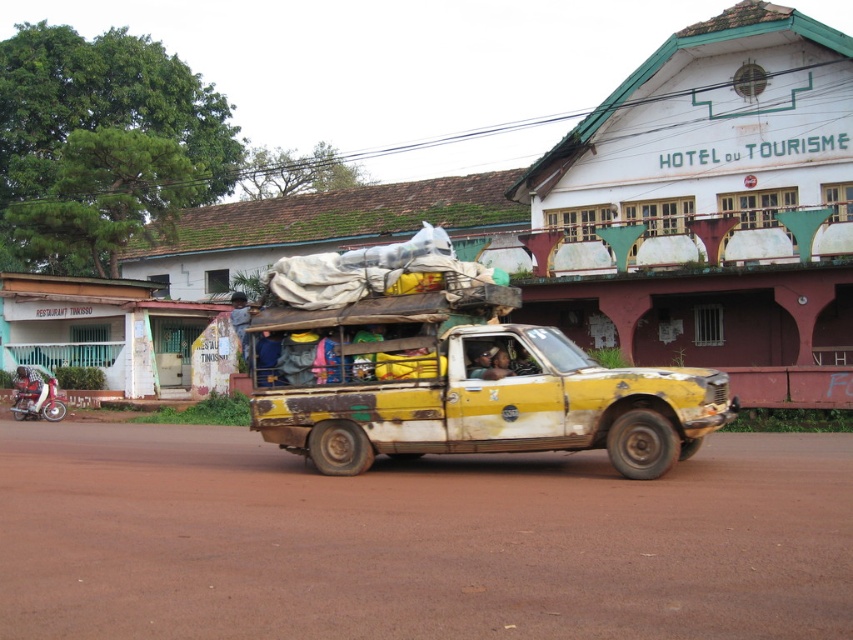
You are a delivery person who needs to move a package from the brushed metal motorcycle at lower left to the rusty yellow pickup truck at center. The package is 1.5 meters long. Can you carry it horizontally without bending it? Explain your reasoning based on the distance between them.

The distance between the rusty yellow pickup truck at center and the brushed metal motorcycle at lower left is 15.55 meters. Since the package is only 1.5 meters long, it can be carried horizontally without bending as the distance is much greater than the package length.

You are standing at the entrance of the HOTEL DU TOURISME and want to find the brown dirt track at center. According to the coordinates provided, where should you look to find it?

The brown dirt track at center is located at the coordinates point [416,540], so you should look towards the center of the image to find it.

You are a tourist standing in front of the HOTEL DU TOURISME and see the brown dirt track at center and the rusty yellow pickup truck at center. Which object is closer to you?

The brown dirt track at center is closer to the viewer than the rusty yellow pickup truck at center.